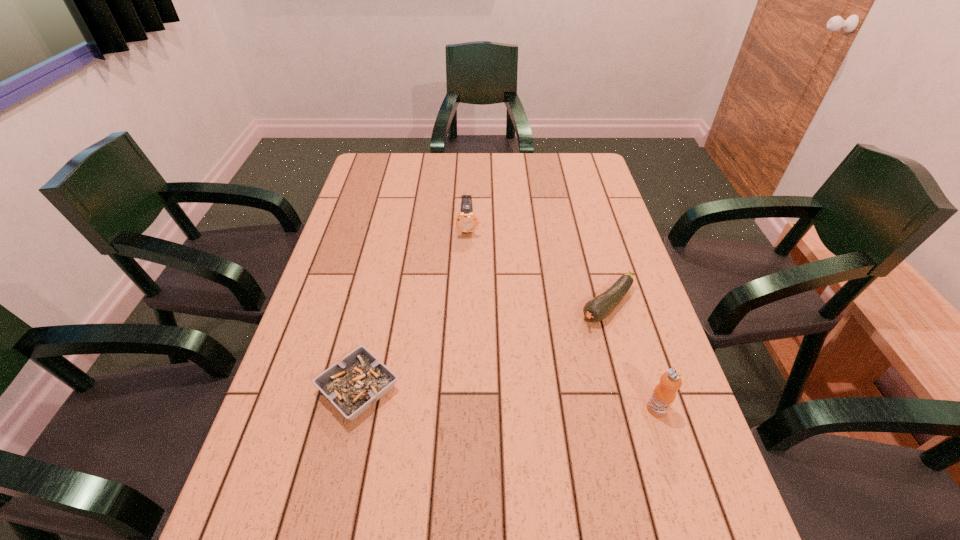
Locate an element on the screen. The height and width of the screenshot is (540, 960). the shortest object is located at coordinates (353, 385).

Locate an element on the screen. ashtray is located at coordinates (353, 385).

I want to click on the tallest object, so click(x=664, y=394).

Find the location of `the second object from left to right`. the second object from left to right is located at coordinates (466, 221).

Locate an element on the screen. The width and height of the screenshot is (960, 540). watch is located at coordinates (466, 221).

Locate an element on the screen. This screenshot has height=540, width=960. the second shortest object is located at coordinates (597, 309).

I want to click on the second farthest object, so click(597, 309).

The width and height of the screenshot is (960, 540). In order to click on free space located 0.350m on the right of the shortest object in this screenshot , I will do `click(557, 389)`.

Locate an element on the screen. This screenshot has height=540, width=960. vacant region located on the front label of the tallest object is located at coordinates (672, 455).

I want to click on vacant space situated on the face of the third shortest object, so click(468, 249).